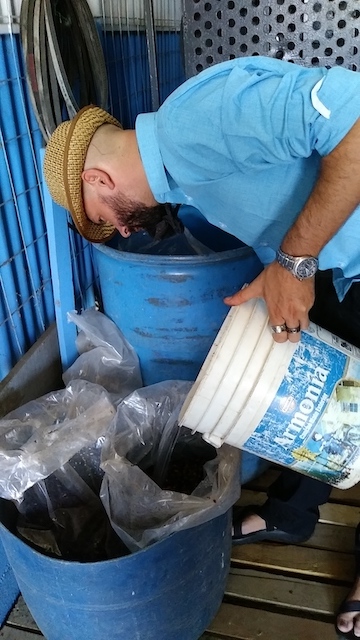
The width and height of the screenshot is (360, 640). Find the location of `short blue bucket`. short blue bucket is located at coordinates (136, 573).